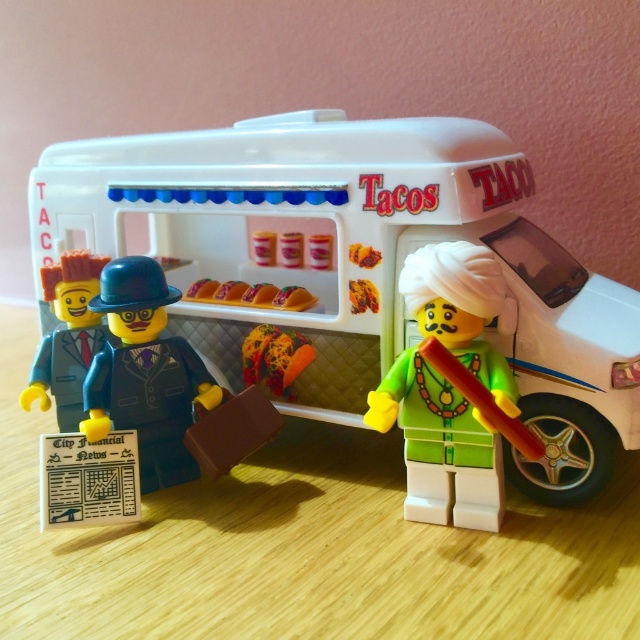
How far apart are smooth plastic man at left and smooth plastic tacos at center?

smooth plastic man at left and smooth plastic tacos at center are 13.47 inches apart.

Can you confirm if smooth plastic man at left is wider than smooth plastic tacos at center?

Yes, smooth plastic man at left is wider than smooth plastic tacos at center.

Describe the element at coordinates (67, 337) in the screenshot. The height and width of the screenshot is (640, 640). I see `smooth plastic man at left` at that location.

Identify the location of smooth plastic man at left. (67, 337).

Who is more forward, (152, 362) or (51, 385)?

Point (152, 362) is in front.

Does matte blue suit at center come behind smooth plastic man at left?

No, matte blue suit at center is in front of smooth plastic man at left.

Does point (132, 291) lie in front of point (67, 268)?

Yes.

What are the coordinates of `matte blue suit at center` in the screenshot? It's located at (145, 372).

Can you confirm if white plastic food truck at center is smaller than smooth plastic man at left?

No.

Which is in front, point (365, 259) or point (40, 403)?

Positioned in front is point (365, 259).

Where is `white plastic food truck at center`? This screenshot has width=640, height=640. white plastic food truck at center is located at coordinates (355, 262).

The width and height of the screenshot is (640, 640). What are the coordinates of `white plastic food truck at center` in the screenshot? It's located at (355, 262).